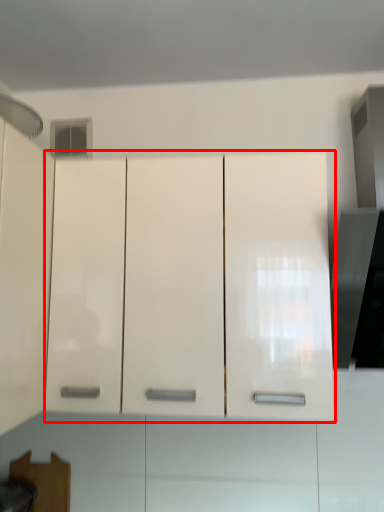
Question: Considering the relative positions of cabinetry (annotated by the red box) and exhaust hood in the image provided, where is cabinetry (annotated by the red box) located with respect to the staircase?

Choices:
 (A) right
 (B) left

Answer: (A)